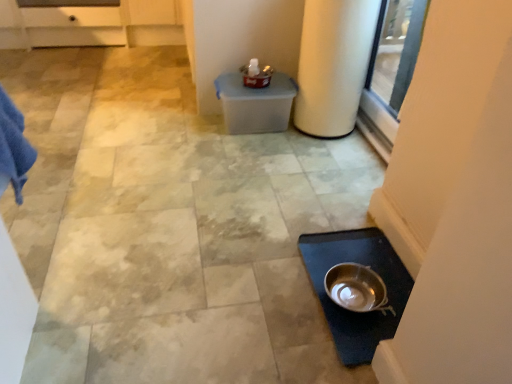
Describe the element at coordinates (357, 288) in the screenshot. I see `silver metallic mixing bowl at lower right` at that location.

The height and width of the screenshot is (384, 512). I want to click on silver metallic mixing bowl at lower right, so click(x=357, y=288).

What do you see at coordinates (333, 64) in the screenshot?
I see `white matte cylindrical at right` at bounding box center [333, 64].

I want to click on white matte cylindrical at right, so click(x=333, y=64).

At what (x,y) coordinates should I click in order to perform the action: click on silver metallic mixing bowl at lower right. Please return your answer as a coordinate pair (x, y). The image size is (512, 384). Looking at the image, I should click on (357, 288).

From the picture: Can you confirm if silver metallic mixing bowl at lower right is positioned to the right of white matte cylindrical at right?

In fact, silver metallic mixing bowl at lower right is to the left of white matte cylindrical at right.

Relative to white matte cylindrical at right, is silver metallic mixing bowl at lower right in front or behind?

silver metallic mixing bowl at lower right is positioned closer to the viewer than white matte cylindrical at right.

Is point (364, 271) in front of point (309, 53)?

Yes.

From the image's perspective, between silver metallic mixing bowl at lower right and white matte cylindrical at right, who is located below?

silver metallic mixing bowl at lower right.

Consider the image. From a real-world perspective, is silver metallic mixing bowl at lower right on white matte cylindrical at right?

No, from a real-world perspective, silver metallic mixing bowl at lower right is not on top of white matte cylindrical at right.

Considering the sizes of objects silver metallic mixing bowl at lower right and white matte cylindrical at right in the image provided, who is thinner, silver metallic mixing bowl at lower right or white matte cylindrical at right?

Thinner between the two is silver metallic mixing bowl at lower right.

Considering the relative sizes of silver metallic mixing bowl at lower right and white matte cylindrical at right in the image provided, is silver metallic mixing bowl at lower right taller than white matte cylindrical at right?

No, silver metallic mixing bowl at lower right is not taller than white matte cylindrical at right.

Is silver metallic mixing bowl at lower right smaller than white matte cylindrical at right?

Yes.

Choose the correct answer: Is silver metallic mixing bowl at lower right inside white matte cylindrical at right or outside it?

silver metallic mixing bowl at lower right is outside white matte cylindrical at right.

Is silver metallic mixing bowl at lower right not close to white matte cylindrical at right?

They are positioned close to each other.

Could you tell me if silver metallic mixing bowl at lower right is facing white matte cylindrical at right?

No, silver metallic mixing bowl at lower right is not oriented towards white matte cylindrical at right.

How different are the orientations of silver metallic mixing bowl at lower right and white matte cylindrical at right in degrees?

There is a 85.1-degree angle between the facing directions of silver metallic mixing bowl at lower right and white matte cylindrical at right.

Find the location of a particular element. This screenshot has width=512, height=384. mixing bowl below the white matte cylindrical at right (from the image's perspective) is located at coordinates (357, 288).

Considering the relative positions of white matte cylindrical at right and silver metallic mixing bowl at lower right in the image provided, is white matte cylindrical at right to the left of silver metallic mixing bowl at lower right from the viewer's perspective?

In fact, white matte cylindrical at right is to the right of silver metallic mixing bowl at lower right.

Is white matte cylindrical at right positioned in front of silver metallic mixing bowl at lower right?

That is False.

Considering the points (329, 86) and (338, 268), which point is behind, point (329, 86) or point (338, 268)?

The point (329, 86) is behind.

From the image's perspective, is white matte cylindrical at right above silver metallic mixing bowl at lower right?

Correct, white matte cylindrical at right appears higher than silver metallic mixing bowl at lower right in the image.

From a real-world perspective, who is located lower, white matte cylindrical at right or silver metallic mixing bowl at lower right?

From a 3D spatial view, silver metallic mixing bowl at lower right is below.

In terms of width, does white matte cylindrical at right look wider or thinner when compared to silver metallic mixing bowl at lower right?

In the image, white matte cylindrical at right appears to be wider than silver metallic mixing bowl at lower right.

Does white matte cylindrical at right have a greater height compared to silver metallic mixing bowl at lower right?

Yes, white matte cylindrical at right is taller than silver metallic mixing bowl at lower right.

Considering the sizes of objects white matte cylindrical at right and silver metallic mixing bowl at lower right in the image provided, who is smaller, white matte cylindrical at right or silver metallic mixing bowl at lower right?

silver metallic mixing bowl at lower right is smaller.

From the picture: Is white matte cylindrical at right positioned beyond the bounds of silver metallic mixing bowl at lower right?

white matte cylindrical at right lies outside silver metallic mixing bowl at lower right's area.

Is white matte cylindrical at right not close to silver metallic mixing bowl at lower right?

That's not correct — white matte cylindrical at right is a little close to silver metallic mixing bowl at lower right.

Could you tell me if white matte cylindrical at right is facing silver metallic mixing bowl at lower right?

No, white matte cylindrical at right does not turn towards silver metallic mixing bowl at lower right.

How different are the orientations of white matte cylindrical at right and silver metallic mixing bowl at lower right in degrees?

85.1 degrees separate the facing orientations of white matte cylindrical at right and silver metallic mixing bowl at lower right.

How far apart are white matte cylindrical at right and silver metallic mixing bowl at lower right?

They are 36.39 inches apart.

What are the coordinates of `pillar above the silver metallic mixing bowl at lower right (from the image's perspective)` in the screenshot? It's located at (x=333, y=64).

Find the location of a particular element. The image size is (512, 384). pillar positioned vertically above the silver metallic mixing bowl at lower right (from a real-world perspective) is located at coordinates (333, 64).

Locate an element on the screen. This screenshot has height=384, width=512. pillar located above the silver metallic mixing bowl at lower right (from the image's perspective) is located at coordinates (333, 64).